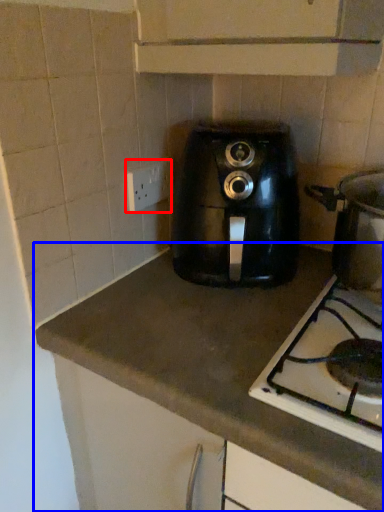
Question: Which object is closer to the camera taking this photo, electric outlet (highlighted by a red box) or countertop (highlighted by a blue box)?

Choices:
 (A) electric outlet
 (B) countertop

Answer: (B)